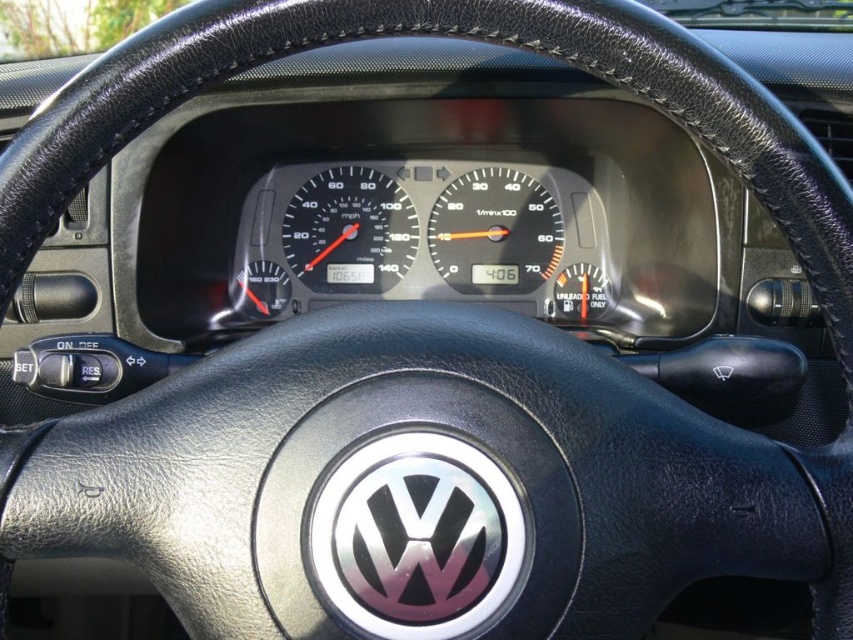
Question: Does black glass speedometer at center appear over matte black speedometer at center?

Choices:
 (A) no
 (B) yes

Answer: (A)

Question: Does black glass speedometer at center appear over matte black speedometer at center?

Choices:
 (A) yes
 (B) no

Answer: (B)

Question: Can you confirm if black glass speedometer at center is positioned to the left of matte black speedometer at center?

Choices:
 (A) no
 (B) yes

Answer: (B)

Question: Which point is closer to the camera?

Choices:
 (A) (415, 241)
 (B) (548, 276)

Answer: (B)